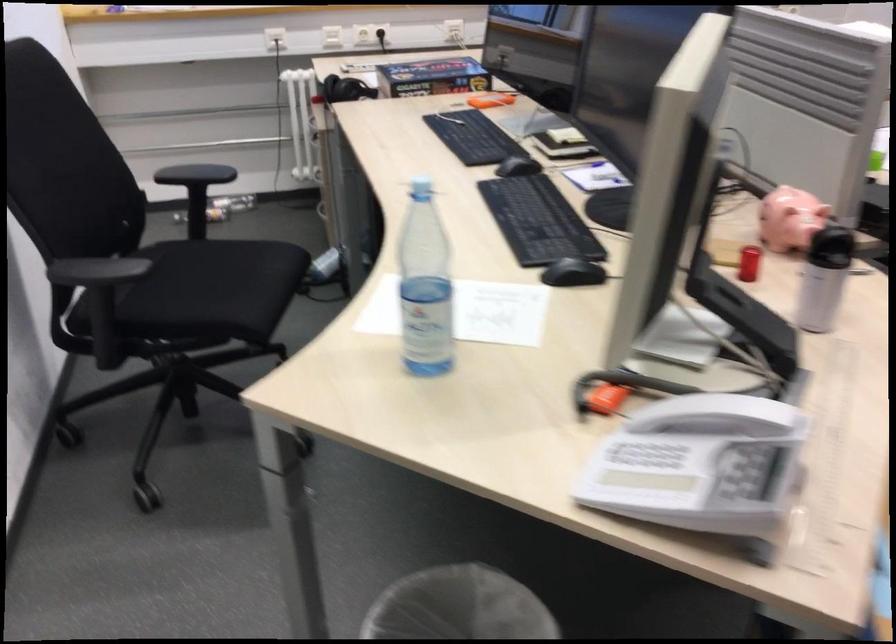
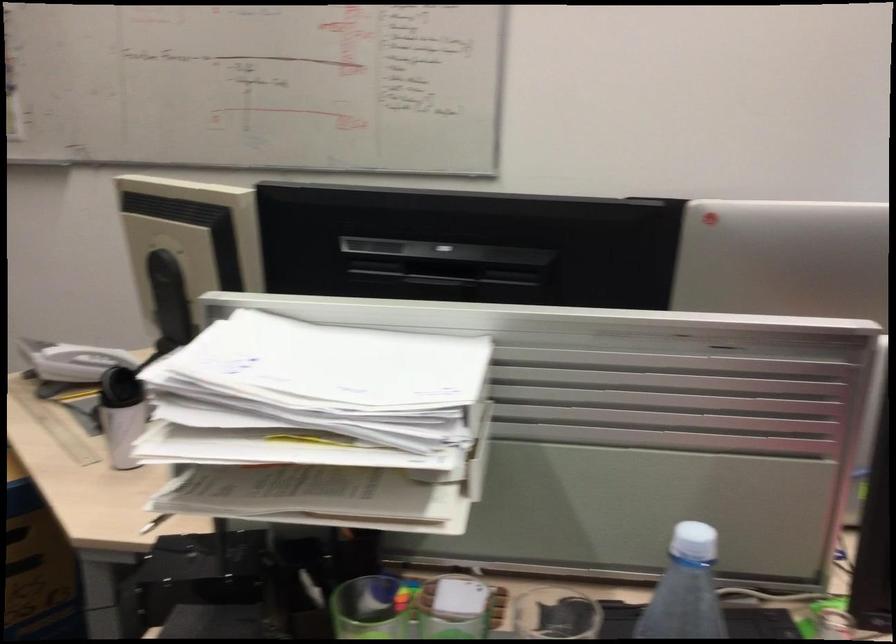
The point at (764, 413) is marked in the first image. Where is the corresponding point in the second image?

(72, 361)